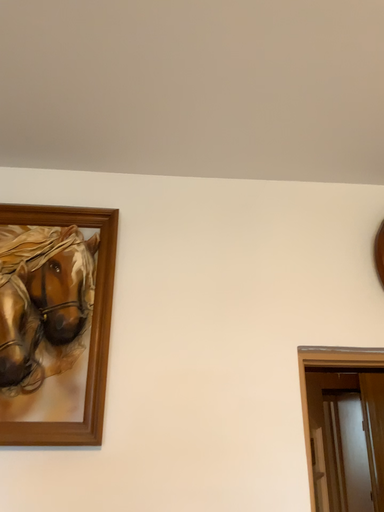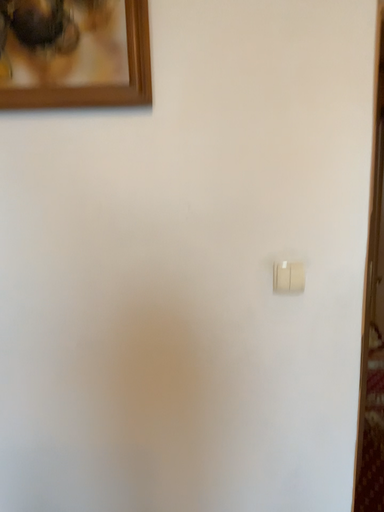
Question: How did the camera likely rotate when shooting the video?

Choices:
 (A) rotated downward
 (B) rotated upward

Answer: (A)